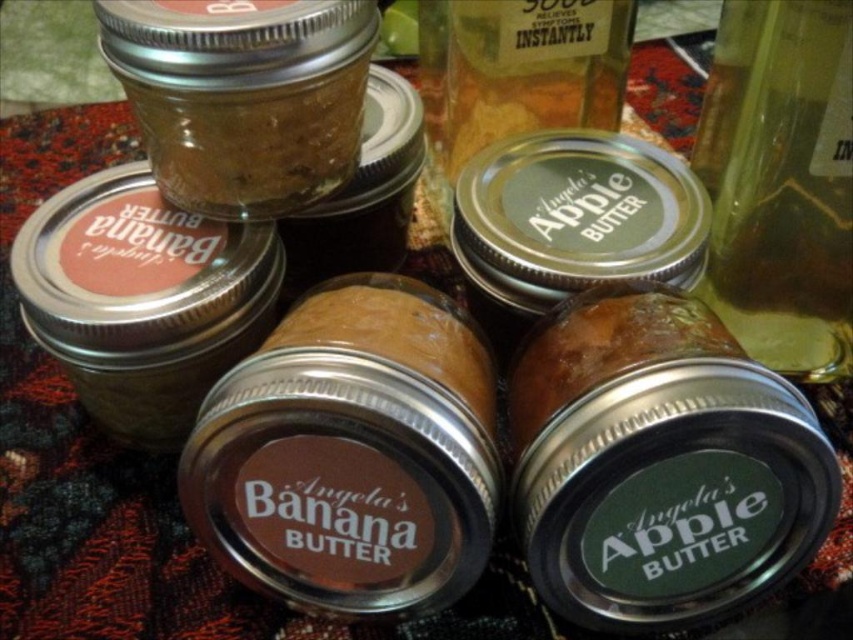
Does transparent glass bottle at center-right have a lesser width compared to matte glass jar at upper left?

Yes.

Between transparent glass bottle at center-right and matte glass jar at upper left, which one is positioned higher?

matte glass jar at upper left

Who is more distant from viewer, [837,360] or [149,29]?

Point [837,360]

Where is `transparent glass bottle at center-right`? transparent glass bottle at center-right is located at coordinates (782, 182).

The image size is (853, 640). What do you see at coordinates (142, 300) in the screenshot?
I see `matte silver jar at upper left` at bounding box center [142, 300].

From the picture: Can you confirm if matte silver jar at upper left is positioned to the right of matte glass jar at upper left?

No, matte silver jar at upper left is not to the right of matte glass jar at upper left.

Which is in front, point (68, 337) or point (241, 177)?

Point (241, 177) is in front.

At what (x,y) coordinates should I click in order to perform the action: click on matte silver jar at upper left. Please return your answer as a coordinate pair (x, y). This screenshot has height=640, width=853. Looking at the image, I should click on (142, 300).

Between transparent glass bottle at center-right and matte silver jar at upper left, which one has more height?

Standing taller between the two is transparent glass bottle at center-right.

Describe the element at coordinates (782, 182) in the screenshot. I see `transparent glass bottle at center-right` at that location.

Locate an element on the screen. This screenshot has height=640, width=853. transparent glass bottle at center-right is located at coordinates (782, 182).